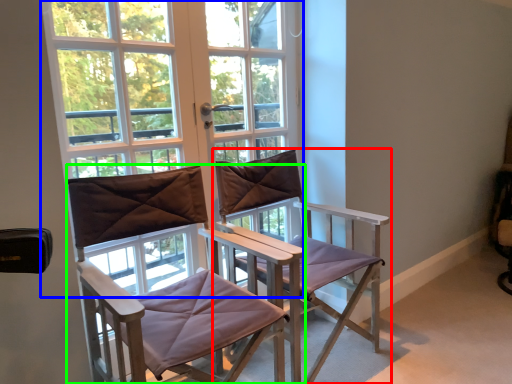
Question: Considering the real-world distances, which object is closest to chair (highlighted by a red box)? window (highlighted by a blue box) or chair (highlighted by a green box).

Choices:
 (A) window
 (B) chair

Answer: (B)